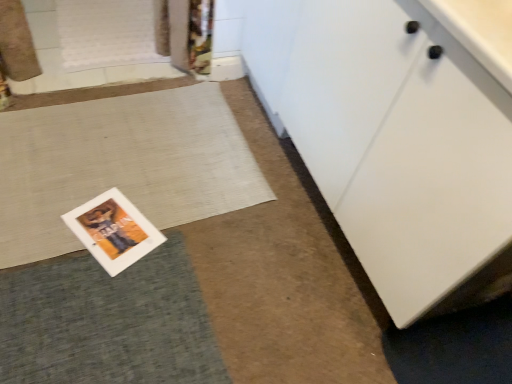
Question: Should I look upward or downward to see white paper postcard at lower left?

Choices:
 (A) down
 (B) up

Answer: (A)